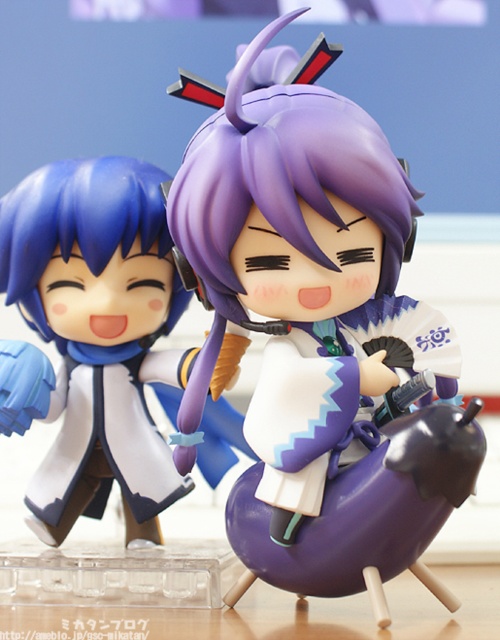
Does point (355, 400) come behind point (151, 504)?

No.

Which is in front, point (334, 252) or point (81, 246)?

Point (334, 252)

Where is `purple matte figure at center`? The image size is (500, 640). purple matte figure at center is located at coordinates (322, 340).